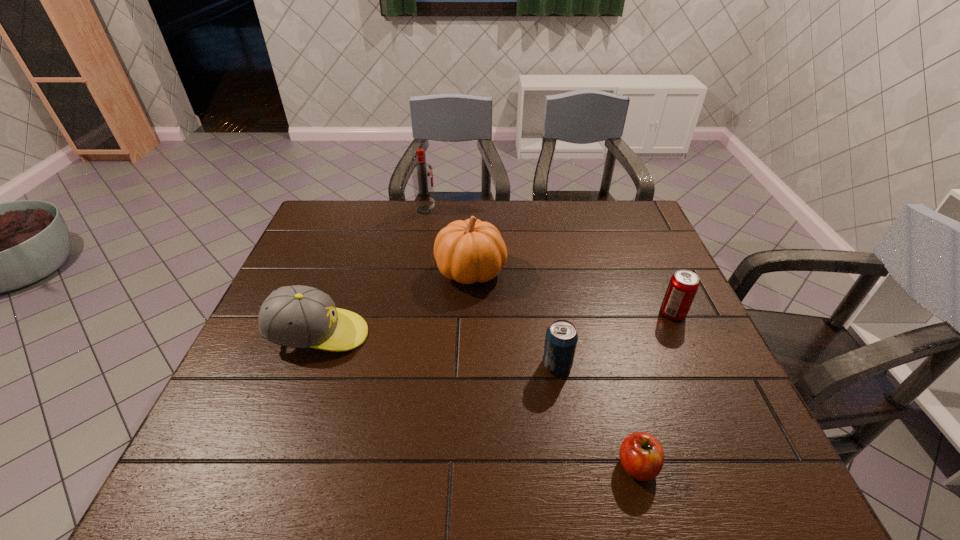
This screenshot has width=960, height=540. I want to click on object that is at the right edge, so click(x=683, y=285).

In the image, there is a desktop. Where is `vacant space at the far edge`? The image size is (960, 540). vacant space at the far edge is located at coordinates (429, 221).

Where is `vacant space at the near edge of the desktop`? The width and height of the screenshot is (960, 540). vacant space at the near edge of the desktop is located at coordinates (296, 481).

Find the location of a particular element. Image resolution: width=960 pixels, height=540 pixels. free space at the left edge of the desktop is located at coordinates (256, 367).

At what (x,y) coordinates should I click in order to perform the action: click on vacant space at the right edge of the desktop. Please return your answer as a coordinate pair (x, y). The image size is (960, 540). Looking at the image, I should click on (729, 382).

You are a GUI agent. You are given a task and a screenshot of the screen. Output one action in this format:
    pyautogui.click(x=<x>, y=<y>)
    Task: Click on the vacant space at the far left corner of the desktop
    The image size is (960, 540).
    Given the screenshot: What is the action you would take?
    click(x=337, y=226)

In the image, there is a desktop. Where is `free space at the far right corner`? The width and height of the screenshot is (960, 540). free space at the far right corner is located at coordinates (609, 231).

Locate an element on the screen. This screenshot has height=540, width=960. free space between the rightmost object and the nearest object is located at coordinates (655, 389).

Find the location of a particular element. This screenshot has height=540, width=960. vacant space that is in between the baseball cap and the fourth object from left to right is located at coordinates (438, 350).

Identify the location of free space between the baseball cap and the farthest object. (372, 272).